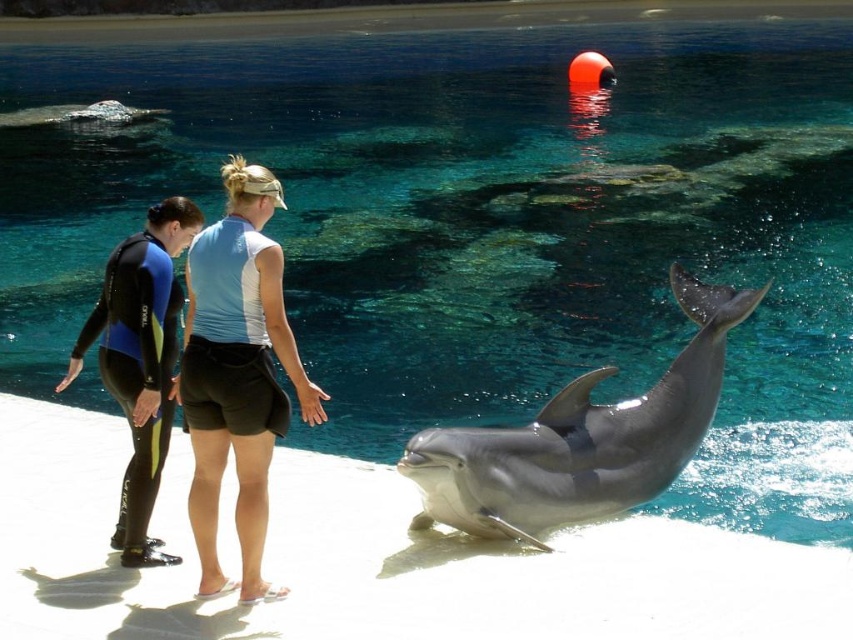
You are a park visitor standing on the white platform near the edge of the large blue water tank. You want to take a photo of the smooth gray dolphin at center. Where should you aim your camera to capture the dolphin in the frame?

You should aim your camera at the 2D location point [581,440] to capture the smooth gray dolphin at center in the frame.

You are a photographer at the marine park and need to capture a close shot of the dolphin. The camera you are using has a zoom range that can focus on a specific point. The point you need to focus on is point (x=581, y=440). What object in the scene does this point correspond to?

The point (x=581, y=440) corresponds to the smooth gray dolphin at center.

You are a marine biologist observing the two people at the marine park. Which of the two individuals is wearing clothing with a narrower width? Please refer to the blue fabric shorts at center and the black neoprene wetsuit at left in your answer.

The blue fabric shorts at center has a lesser width compared to the black neoprene wetsuit at left, so the individual wearing the blue fabric shorts at center has clothing with a narrower width.